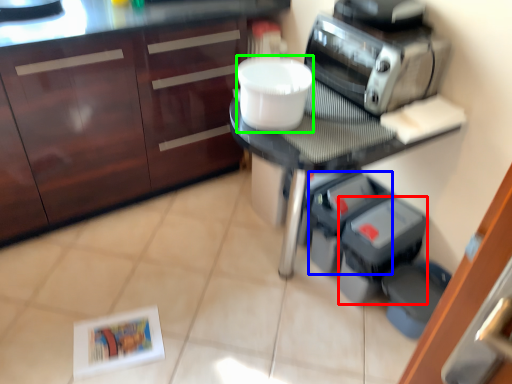
Question: Which object is the farthest from appliance (highlighted by a red box)? Choose among these: appliance (highlighted by a blue box) or toilet bowl (highlighted by a green box).

Choices:
 (A) appliance
 (B) toilet bowl

Answer: (B)